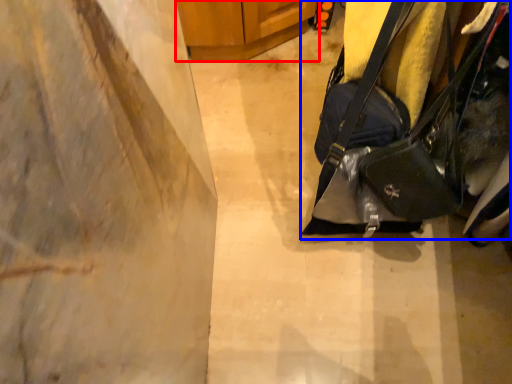
Question: Among these objects, which one is nearest to the camera, furniture (highlighted by a red box) or handbag (highlighted by a blue box)?

Choices:
 (A) furniture
 (B) handbag

Answer: (B)